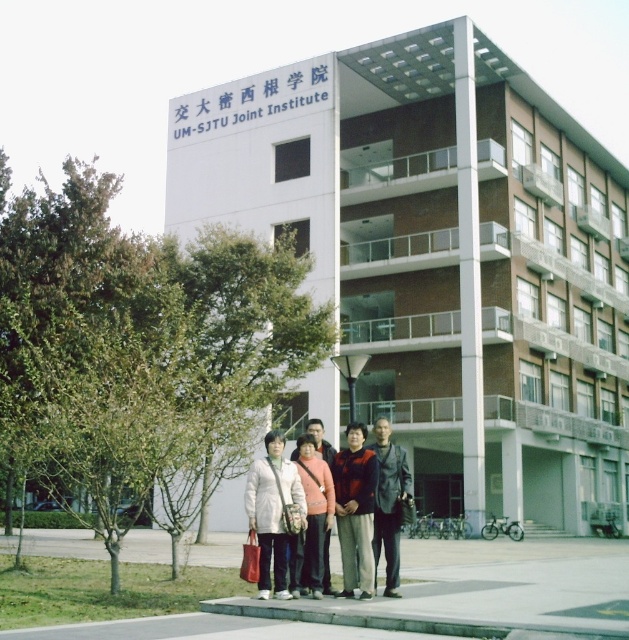
Question: Is matte white coat at center positioned behind dark gray leather jacket at center?

Choices:
 (A) yes
 (B) no

Answer: (B)

Question: Which object is positioned farthest from the dark red sweater at center?

Choices:
 (A) matte pink sweater at center
 (B) matte white coat at center

Answer: (B)

Question: Does dark red sweater at center have a greater width compared to dark gray leather jacket at center?

Choices:
 (A) no
 (B) yes

Answer: (B)

Question: Which point appears closest to the camera in this image?

Choices:
 (A) (264, 516)
 (B) (377, 538)
 (C) (308, 452)

Answer: (A)

Question: Does dark red sweater at center appear on the right side of dark gray leather jacket at center?

Choices:
 (A) yes
 (B) no

Answer: (B)

Question: Which of the following is the farthest from the observer?

Choices:
 (A) matte pink sweater at center
 (B) matte white coat at center

Answer: (A)